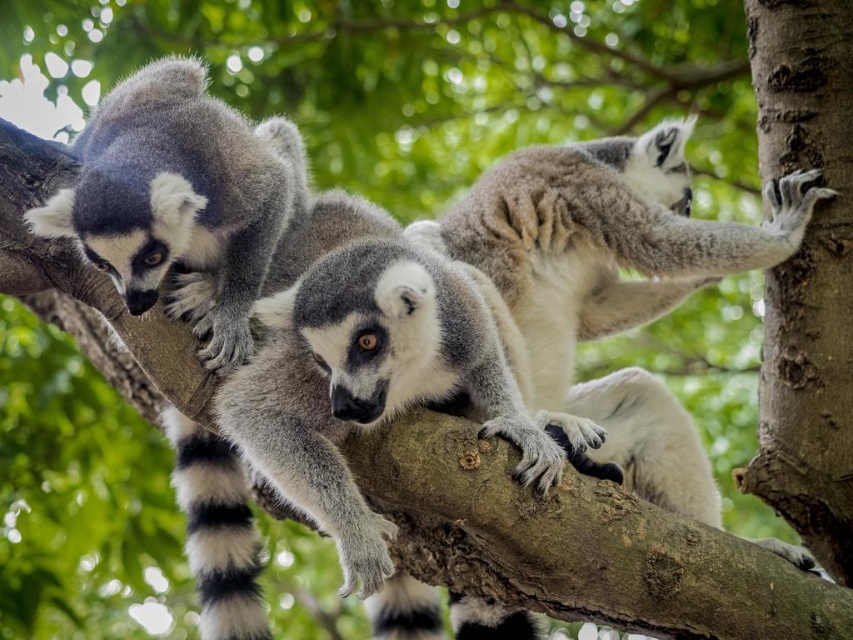
Question: Does ring-tailed lemur at left lie behind black and white striped tail at center?

Choices:
 (A) yes
 (B) no

Answer: (B)

Question: Does ring-tailed lemur at left have a larger size compared to black and white striped tail at center?

Choices:
 (A) no
 (B) yes

Answer: (B)

Question: Which point is farther to the camera?

Choices:
 (A) (171, 424)
 (B) (151, 291)

Answer: (A)

Question: Among these points, which one is farthest from the camera?

Choices:
 (A) (155, 237)
 (B) (196, 465)

Answer: (B)

Question: Is ring-tailed lemur at left closer to camera compared to black and white striped tail at center?

Choices:
 (A) yes
 (B) no

Answer: (A)